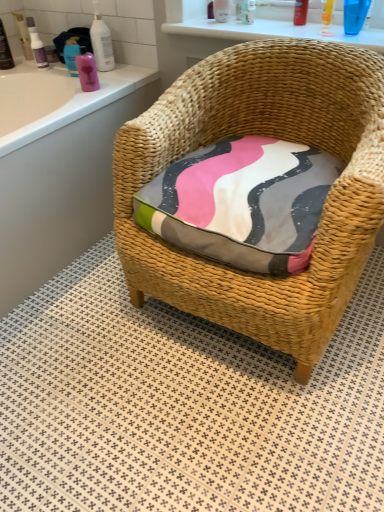
Locate an element on the screen. The image size is (384, 512). free space that is in between pink glossy bottle at upper left, the fourth toiletry viewed from the left, and matte black bottle at upper left, the 1th toiletry when ordered from left to right is located at coordinates (34, 72).